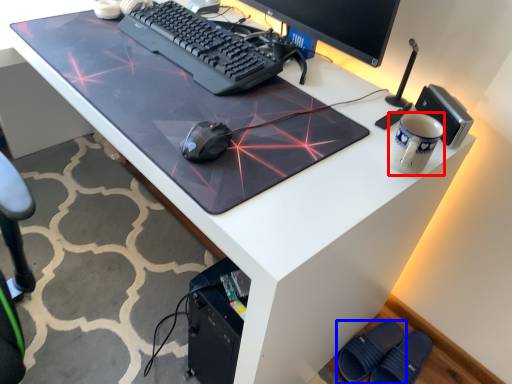
Question: Which object appears farthest to the camera in this image, mug (highlighted by a red box) or footwear (highlighted by a blue box)?

Choices:
 (A) mug
 (B) footwear

Answer: (B)